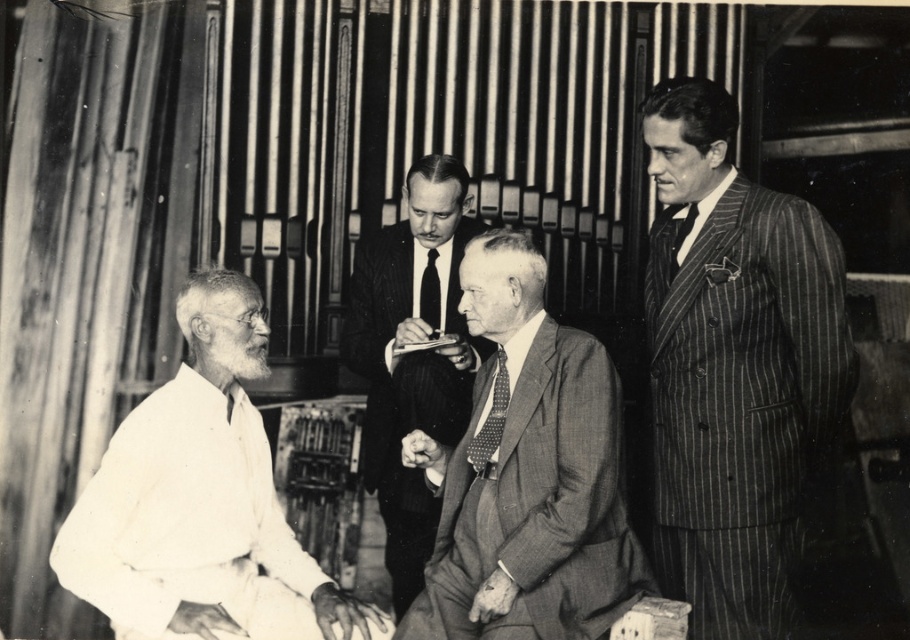
Locate an element on the screen. Image resolution: width=910 pixels, height=640 pixels. striped wool suit at right is located at coordinates (734, 369).

Between striped wool suit at right and gray textured suit at center, which one is positioned lower?

gray textured suit at center is below.

You are a GUI agent. You are given a task and a screenshot of the screen. Output one action in this format:
    pyautogui.click(x=<x>, y=<y>)
    Task: Click on the striped wool suit at right
    
    Given the screenshot: What is the action you would take?
    pyautogui.click(x=734, y=369)

Can you confirm if striped wool suit at right is positioned to the right of smooth black suit at center?

Indeed, striped wool suit at right is positioned on the right side of smooth black suit at center.

Which is more to the left, striped wool suit at right or smooth black suit at center?

Positioned to the left is smooth black suit at center.

Is point (771, 378) less distant than point (460, 417)?

Yes.

Where is `striped wool suit at right`? striped wool suit at right is located at coordinates (734, 369).

Which is more to the right, gray textured suit at center or black silk tie at right?

Positioned to the right is black silk tie at right.

Is point (568, 476) positioned behind point (684, 234)?

No, (568, 476) is in front of (684, 234).

The image size is (910, 640). Identify the location of gray textured suit at center. point(527,474).